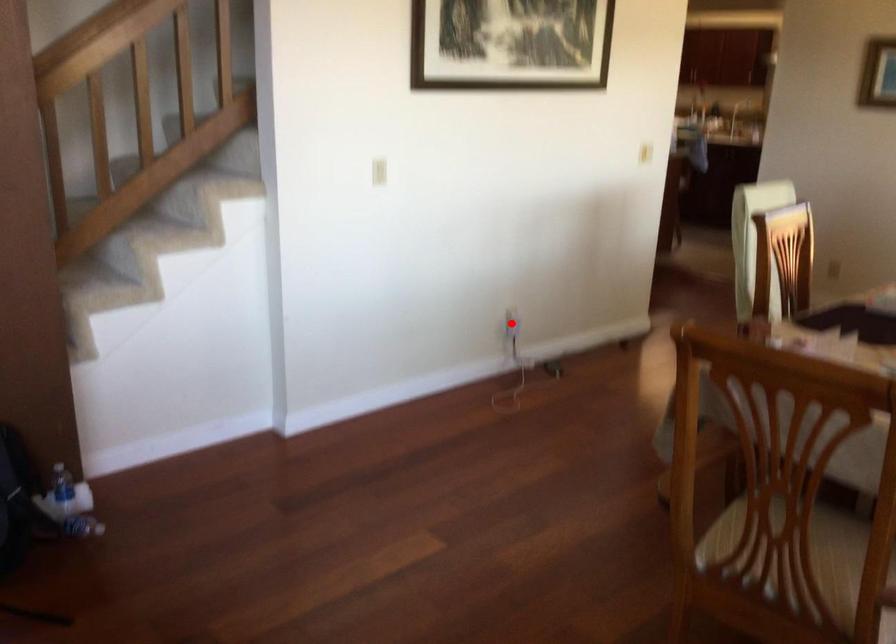
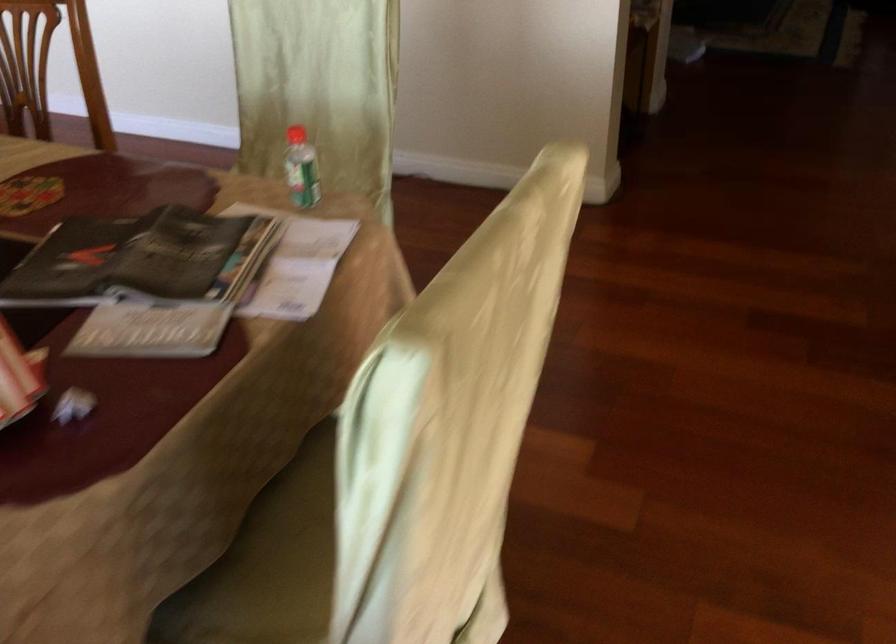
Question: I am providing you with two images of the same scene from different viewpoints. A red point is marked on the first image. Is the red point's position out of view in image 2?

Choices:
 (A) Yes
 (B) No

Answer: (A)